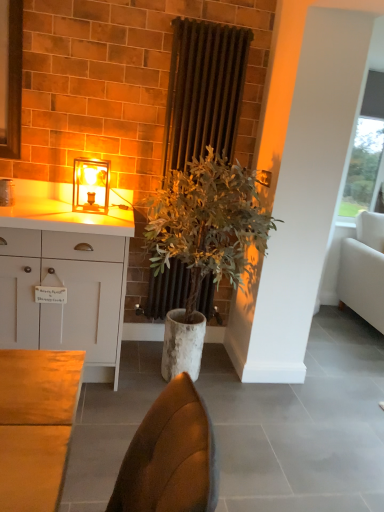
At what (x,y) coordinates should I click in order to perform the action: click on vacant space underneath matte glass table lamp at upper left (from a real-world perspective). Please return your answer as a coordinate pair (x, y). Image resolution: width=384 pixels, height=512 pixels. Looking at the image, I should click on (97, 211).